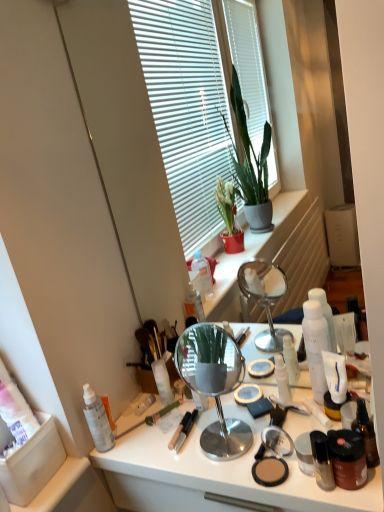
The image size is (384, 512). I want to click on free region on the left part of matte brown jar at lower right, marked as the second toiletry in a right-to-left arrangement, so click(271, 477).